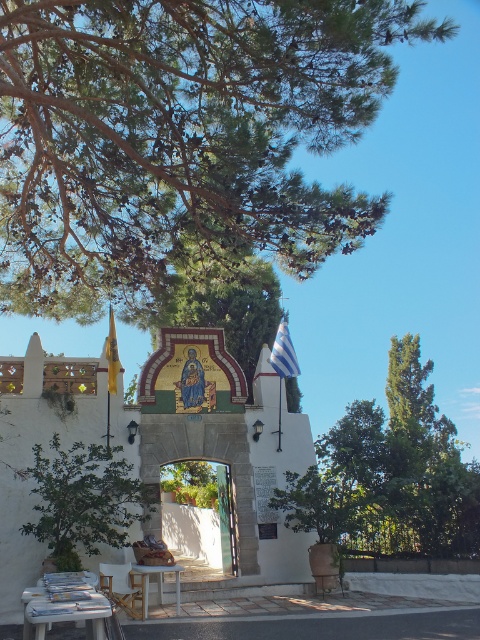
You are standing at the entrance of the religious site and want to take a photo that includes both the green leafy tree at right and the green leafy tree at left. Since you want the larger tree to be the main focus, which tree should you position closer to the center of the frame?

The green leafy tree at left is larger than the green leafy tree at right, so you should position the green leafy tree at left closer to the center of the frame to make it the main focus.

You are standing at the entrance of the religious site and want to take a photo that includes both the green leafy tree at right and the green leafy tree at left. Which tree should you move closer to in order to include both in your photo?

You should move closer to the green leafy tree at left because it is farther away from you than the green leafy tree at right, so adjusting your position towards it will help frame both trees within the photo.